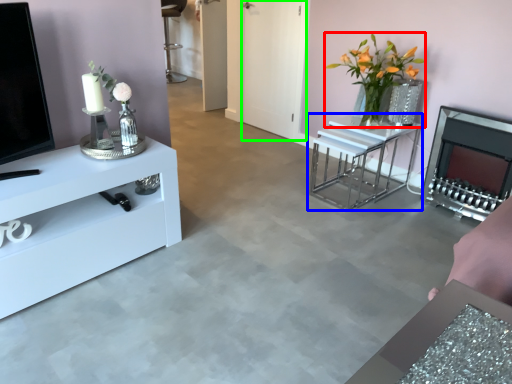
Question: Which object is the closest to the floral arrangement (highlighted by a red box)? Choose among these: table (highlighted by a blue box) or glass door (highlighted by a green box).

Choices:
 (A) table
 (B) glass door

Answer: (A)